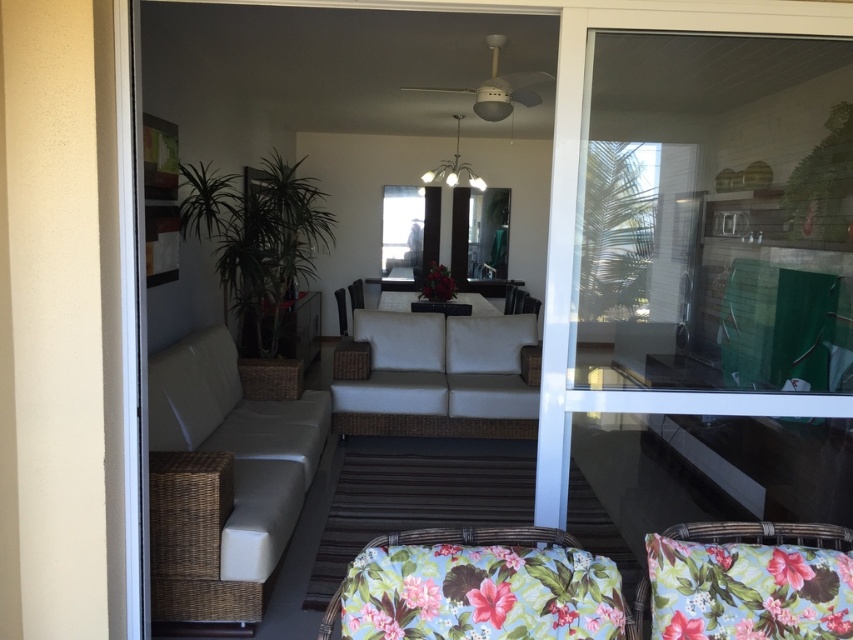
You are planning to rearrange the furniture in the living room and want to place a new rectangular coffee table between the white leather couch at center and the white fabric pillow at center. Which object should the coffee table be placed closer to if the couch is bigger?

The white leather couch at center is larger in size than the white fabric pillow at center, so the coffee table should be placed closer to the white fabric pillow at center to balance the space.